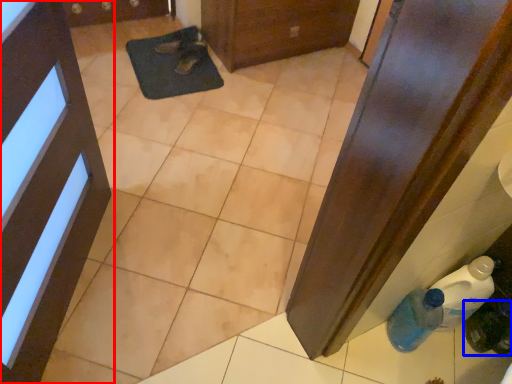
Question: Which point is further to the camera, door (highlighted by a red box) or bottle (highlighted by a blue box)?

Choices:
 (A) door
 (B) bottle

Answer: (B)